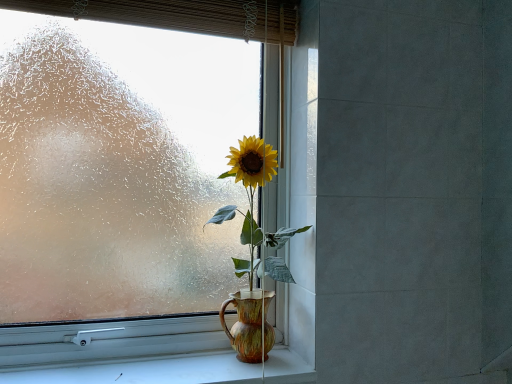
Question: Relative to bamboo curtain at upper center, is frosted glass window at center in front or behind?

Choices:
 (A) behind
 (B) front

Answer: (A)

Question: Do you think frosted glass window at center is within bamboo curtain at upper center, or outside of it?

Choices:
 (A) outside
 (B) inside

Answer: (A)

Question: Which is farther from the bamboo curtain at upper center?

Choices:
 (A) gray tile at right
 (B) white smooth window sill at lower center
 (C) frosted glass window at center
 (D) matte ceramic vase at center

Answer: (B)

Question: Estimate the real-world distances between objects in this image. Which object is closer to the white smooth window sill at lower center?

Choices:
 (A) frosted glass window at center
 (B) bamboo curtain at upper center
 (C) gray tile at right
 (D) matte ceramic vase at center

Answer: (D)